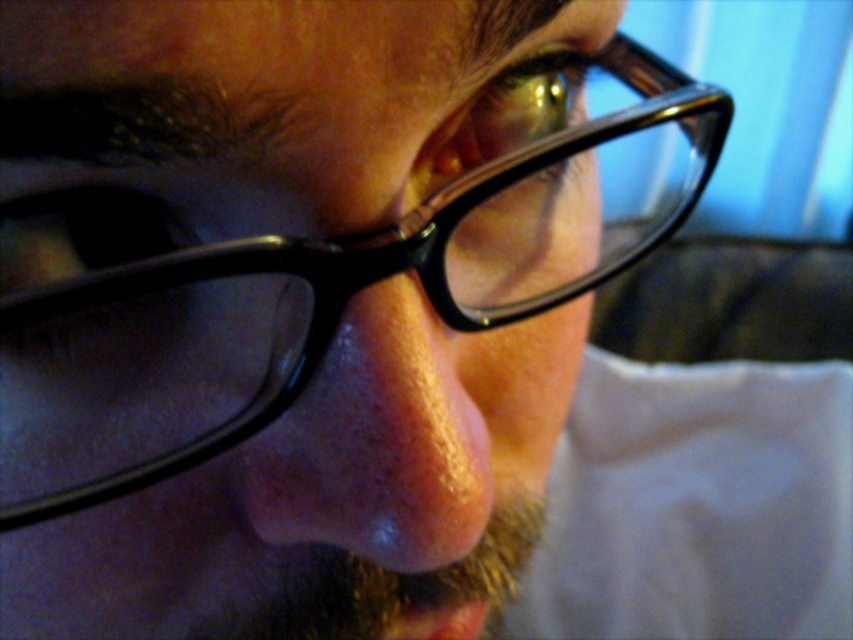
You are a photographer adjusting the focus on your camera. The subject is wearing black plastic glasses at center. If your camera requires the subject to be at least 7 inches away to focus properly, will the current distance work?

The distance between the black plastic glasses at center and the camera is 6.53 inches, which is less than the required 7 inches. Therefore, the current distance will not allow proper focus.

You are taking a photo of the person in the image. You want to focus on the point closer to the camera. Which point should you choose, point (x=90, y=586) or point (x=451, y=355)?

→ Point (x=90, y=586) is closer to the camera than point (x=451, y=355), so you should choose point (x=90, y=586) to focus on.